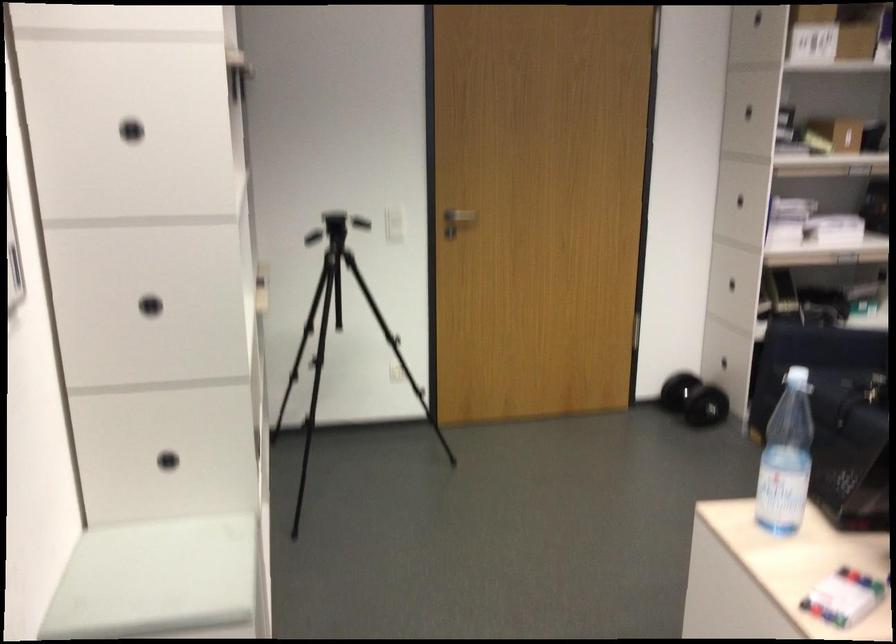
Describe the element at coordinates (393, 214) in the screenshot. The image size is (896, 644). I see `the white light switch` at that location.